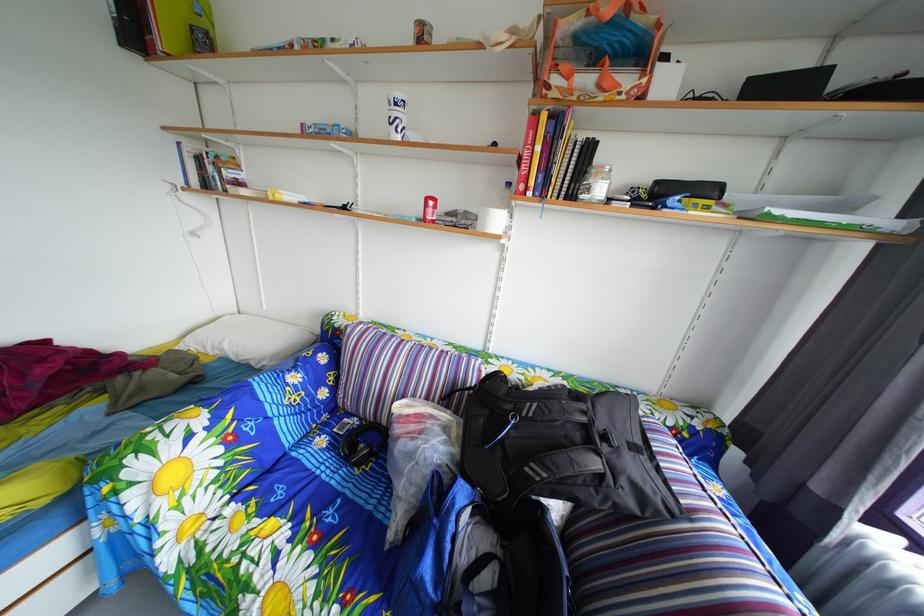
Which object does [594,184] point to?

It refers to a glass jar.